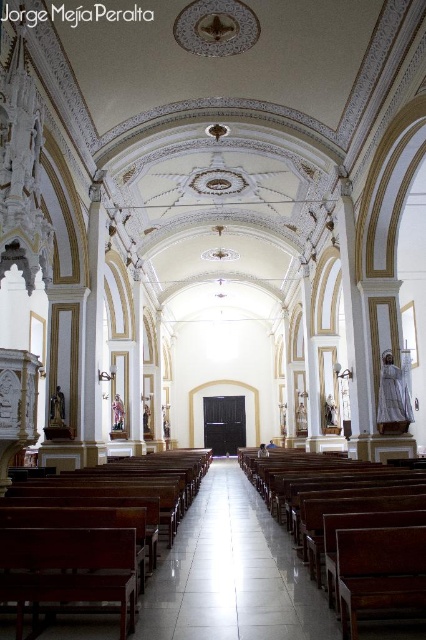
You are a visitor in the church and need to sit down. You see the polished wood bench at center and the wooden church bench at center. Which one is closer to you?

The polished wood bench at center and wooden church bench at center are 39.28 feet apart from each other, so you need to specify your current position to determine which is closer.